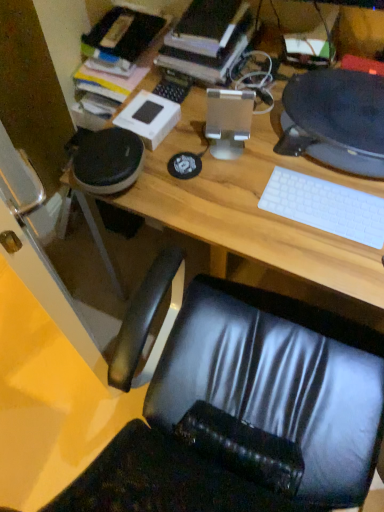
Question: In the image, is matte black desktop computer at upper right, which appears as the first desktop computer when viewed from the right, positioned in front of or behind wooden desk at center?

Choices:
 (A) front
 (B) behind

Answer: (B)

Question: Would you say matte black desktop computer at upper right, which ranks as the second desktop computer in left-to-right order, is to the left or to the right of wooden desk at center in the picture?

Choices:
 (A) right
 (B) left

Answer: (A)

Question: Which is nearer to the hardcover book at upper center?

Choices:
 (A) wooden desk at center
 (B) matte black desktop computer at upper right, which ranks as the second desktop computer in left-to-right order
 (C) satin silver desktop computer at center, which is the 2th desktop computer from right to left
 (D) white matte keyboard at right

Answer: (C)

Question: Which object is positioned closest to the wooden desk at center?

Choices:
 (A) satin silver desktop computer at center, which ranks as the first desktop computer in left-to-right order
 (B) matte black desktop computer at upper right, which appears as the first desktop computer when viewed from the right
 (C) hardcover book at upper center
 (D) white matte keyboard at right

Answer: (D)